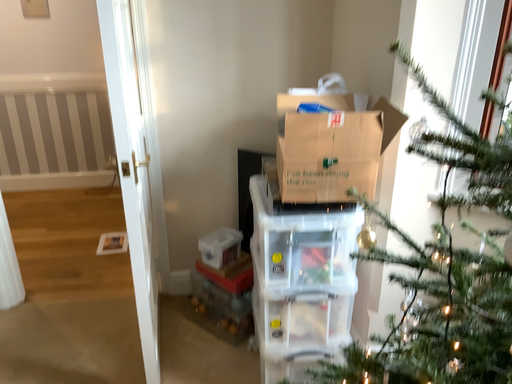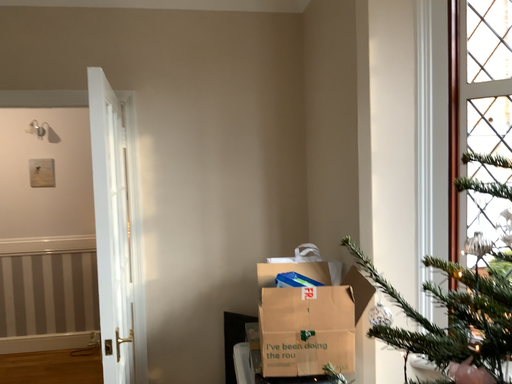
Question: Which way did the camera rotate in the video?

Choices:
 (A) rotated downward
 (B) rotated upward

Answer: (B)